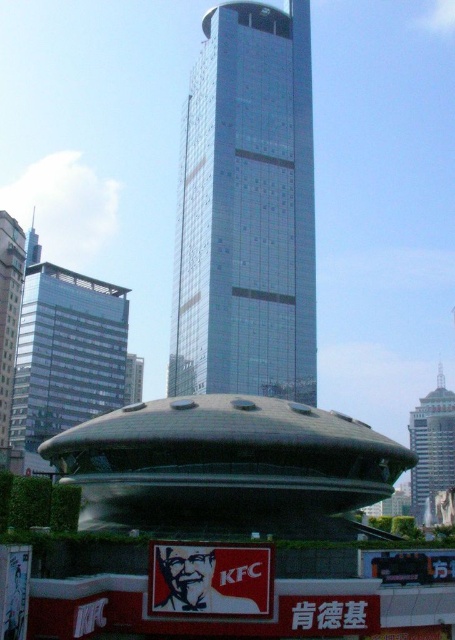
You are an architect planning to install a new billboard between the glassy metallic skyscraper at center and the glassy silver skyscraper at left. The billboard requires a minimum width of 20 meters to be visible from afar. Based on their widths, can the space between them accommodate the billboard?

The glassy metallic skyscraper at center is wider than the glassy silver skyscraper at left. However, without specific measurements of their widths or the distance between them, it is impossible to determine if the space between them is at least 20 meters wide. Additional information is needed to confirm.

You are standing at the entrance of the KFC signboard and want to take a photo of the glassy metallic skyscraper at center. Which direction should you face to capture the skyscraper in your camera view?

The glassy metallic skyscraper at center is located at point coordinates relative to your position, so you should face towards the center direction to capture it in your camera view.